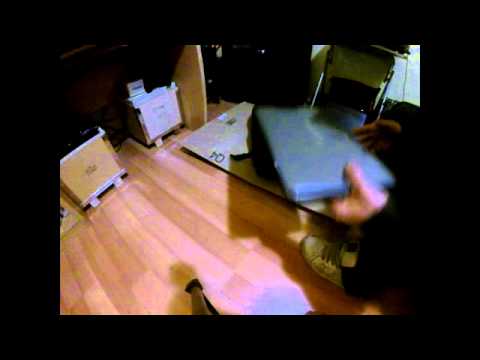
Image resolution: width=480 pixels, height=360 pixels. I want to click on cardboard box, so click(x=211, y=141).